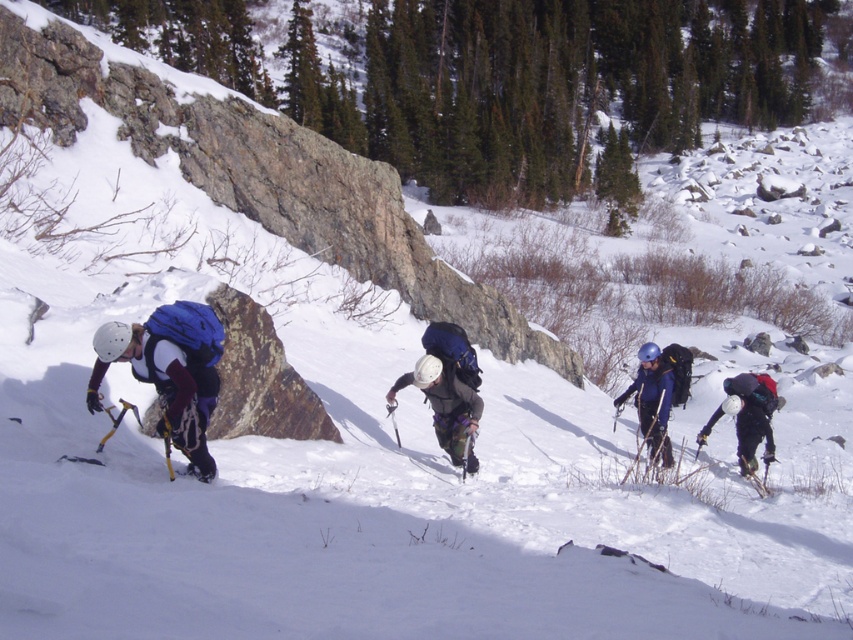
Question: Can you confirm if matte white helmet at center is thinner than matte black backpack at lower right?

Choices:
 (A) no
 (B) yes

Answer: (A)

Question: Which is farther from the matte white helmet at center?

Choices:
 (A) matte blue jacket at left
 (B) matte black backpack at lower right
 (C) blue matte helmet at center

Answer: (B)

Question: In this image, where is matte white helmet at center located relative to matte black backpack at lower right?

Choices:
 (A) below
 (B) above

Answer: (B)

Question: Is matte blue jacket at left bigger than blue matte helmet at center?

Choices:
 (A) no
 (B) yes

Answer: (A)

Question: Among these objects, which one is farthest from the camera?

Choices:
 (A) matte black backpack at lower right
 (B) matte blue jacket at left

Answer: (A)

Question: Which point appears closest to the camera in this image?

Choices:
 (A) (469, 458)
 (B) (196, 330)

Answer: (B)